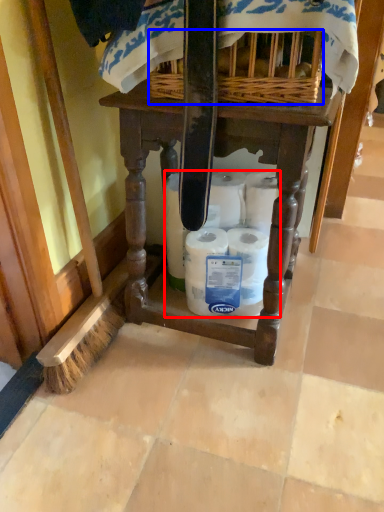
Question: Which point is closer to the camera, toilet paper (highlighted by a red box) or basket (highlighted by a blue box)?

Choices:
 (A) toilet paper
 (B) basket

Answer: (B)